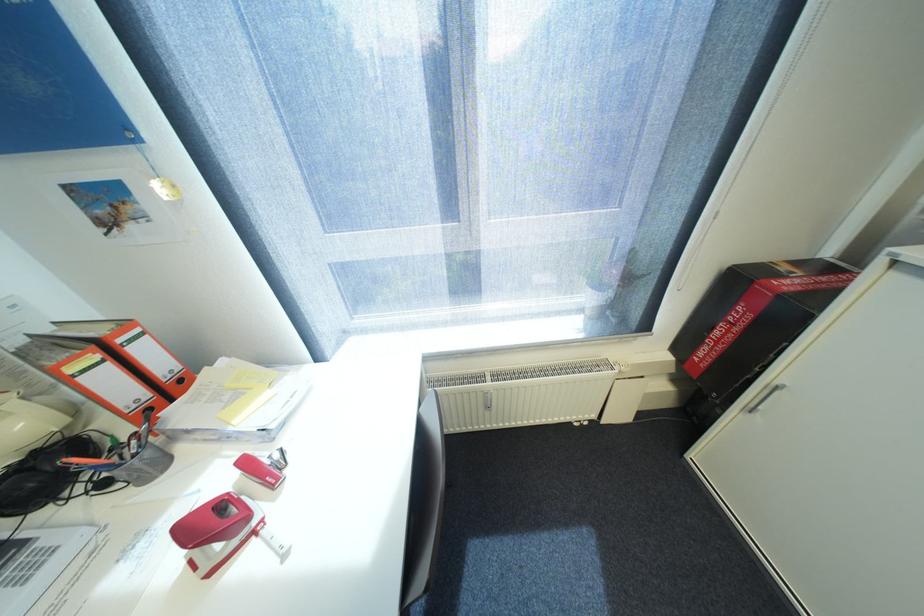
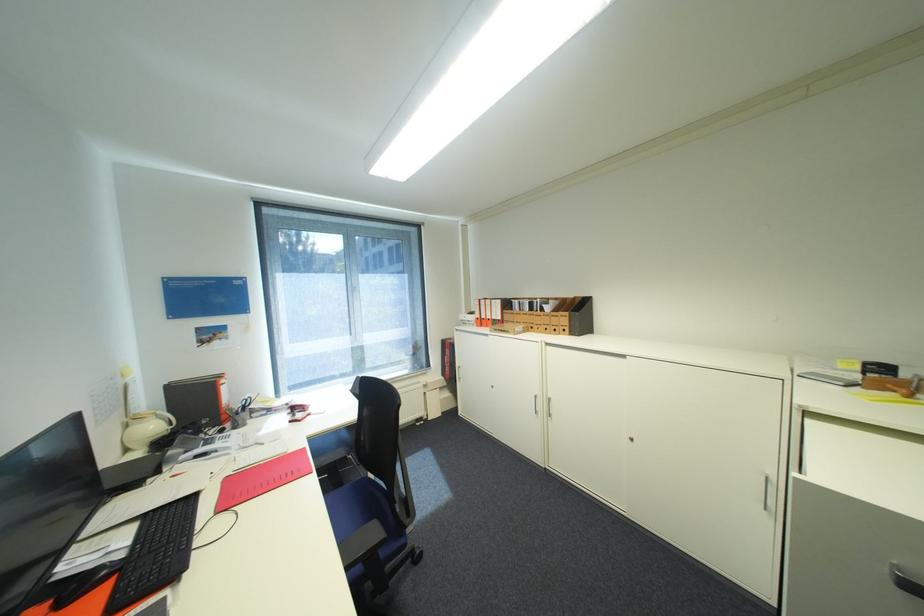
Locate, in the second image, the point that corresponds to (30,424) in the first image.

(161, 427)